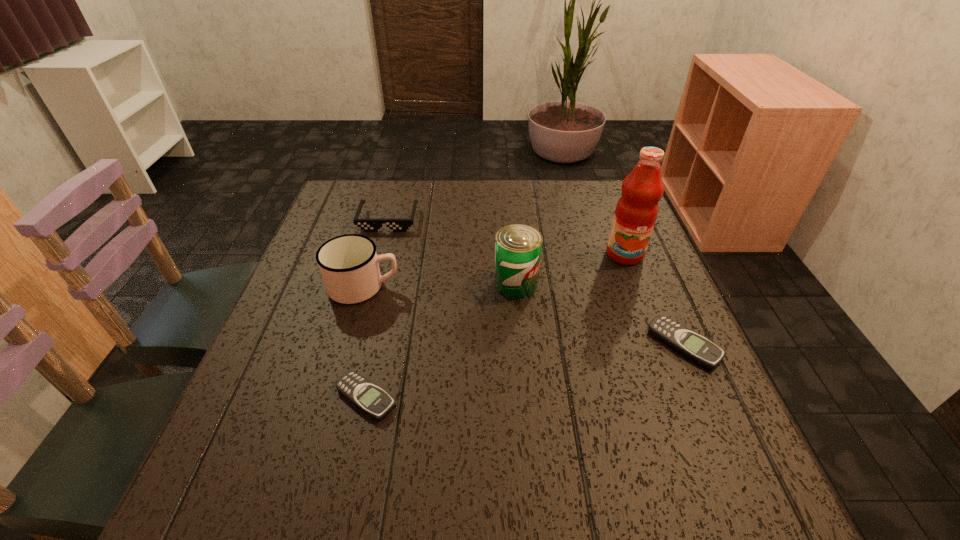
Locate which object is the third closest to the second nearest object. Please provide its 2D coordinates. Your answer should be formatted as a tuple, i.e. [(x, y)], where the tuple contains the x and y coordinates of a point satisfying the conditions above.

[(367, 396)]

I want to click on vacant space that satisfies the following two spatial constraints: 1. on the side of the shortest object with the handle; 2. on the left side of the mug, so click(x=332, y=398).

Image resolution: width=960 pixels, height=540 pixels. In order to click on free location that satisfies the following two spatial constraints: 1. on the side of the third tallest object with the handle; 2. on the back side of the second shortest object in this screenshot , I will do `click(347, 345)`.

I want to click on vacant space that satisfies the following two spatial constraints: 1. on the front-facing side of the farther beeper; 2. on the right side of the farthest object, so click(355, 345).

The height and width of the screenshot is (540, 960). What are the coordinates of `blank area in the image that satisfies the following two spatial constraints: 1. on the front-facing side of the third shortest object; 2. on the side of the third tallest object with the handle` in the screenshot? It's located at (371, 287).

You are a GUI agent. You are given a task and a screenshot of the screen. Output one action in this format:
    pyautogui.click(x=<x>, y=<y>)
    Task: Click on the vacant area in the image that satisfies the following two spatial constraints: 1. on the side of the taller beeper with the handle; 2. on the left side of the mug
    
    Given the screenshot: What is the action you would take?
    pyautogui.click(x=347, y=345)